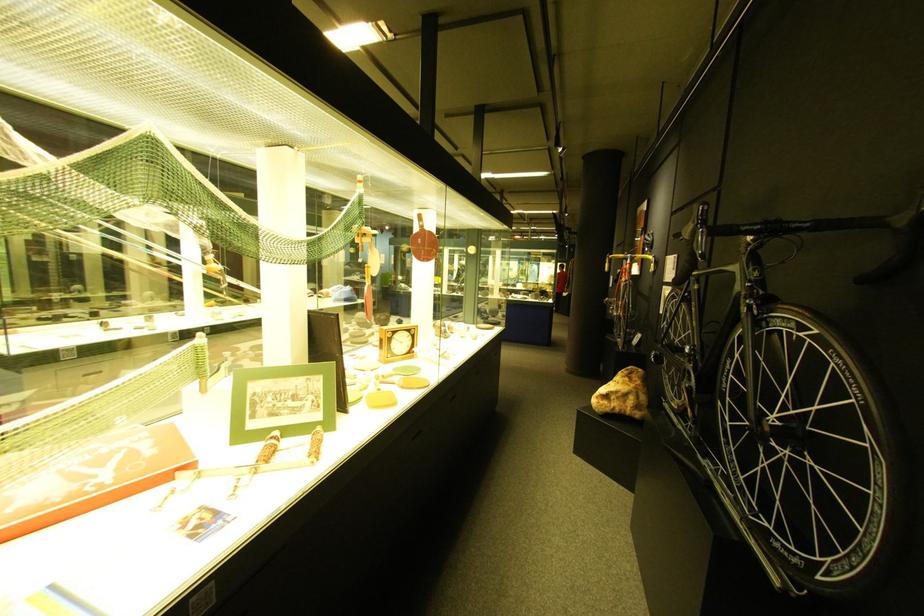
Find where to grip the yellow handlebar grip. Please return your answer as a coordinate pair (x, y).

(608, 262)